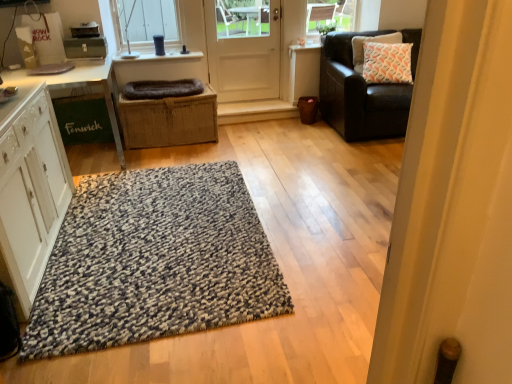
This screenshot has height=384, width=512. Find the location of `white wood cabinet at left`. white wood cabinet at left is located at coordinates (31, 190).

What do you see at coordinates (169, 120) in the screenshot? Image resolution: width=512 pixels, height=384 pixels. I see `braided wicker basket at center` at bounding box center [169, 120].

Where is `white matte door at center`? This screenshot has height=384, width=512. white matte door at center is located at coordinates (243, 48).

Find the location of a particular element. clear glass window at upper center is located at coordinates [147, 21].

Where is `white glossy table at left`? This screenshot has width=512, height=384. white glossy table at left is located at coordinates (83, 90).

Measure the distance between point (152, 223) and camera.

8.92 feet.

Locate an element on the screen. The image size is (512, 384). dark gray plush dog bed at center is located at coordinates (162, 89).

Is dark gray plush dog bed at center next to clear glass window at upper center?

No, dark gray plush dog bed at center is not touching clear glass window at upper center.

From the image's perspective, which one is positioned higher, dark gray plush dog bed at center or clear glass window at upper center?

clear glass window at upper center.

Does dark gray plush dog bed at center have a larger size compared to clear glass window at upper center?

Incorrect, dark gray plush dog bed at center is not larger than clear glass window at upper center.

Which point is more distant from viewer, (125,86) or (144,34)?

The point (144,34) is farther from the camera.

Is white wood cabinet at left in front of or behind clear glass window at upper center in the image?

Clearly, white wood cabinet at left is in front of clear glass window at upper center.

Can clear glass window at upper center be found inside white wood cabinet at left?

That's incorrect, clear glass window at upper center is not inside white wood cabinet at left.

From a real-world perspective, is white wood cabinet at left located higher than clear glass window at upper center?

Actually, white wood cabinet at left is physically below clear glass window at upper center in the real world.

At what (x,y) coordinates should I click in order to perform the action: click on window located on the right of white wood cabinet at left. Please return your answer as a coordinate pair (x, y). The image size is (512, 384). Looking at the image, I should click on (147, 21).

How much distance is there between braided wicker basket at center and dark gray plush dog bed at center?

braided wicker basket at center is 23.50 centimeters from dark gray plush dog bed at center.

Looking at their sizes, would you say braided wicker basket at center is wider or thinner than dark gray plush dog bed at center?

Clearly, braided wicker basket at center has more width compared to dark gray plush dog bed at center.

Would you say dark gray plush dog bed at center is part of braided wicker basket at center's contents?

No, dark gray plush dog bed at center is not a part of braided wicker basket at center.

From the image's perspective, between braided wicker basket at center and dark gray plush dog bed at center, which one is located above?

dark gray plush dog bed at center appears higher in the image.

Is white printed cushion at upper right oriented towards white matte door at center?

No, white printed cushion at upper right does not turn towards white matte door at center.

From the image's perspective, is white printed cushion at upper right below white matte door at center?

Yes, from the image's perspective, white printed cushion at upper right is beneath white matte door at center.

Considering their positions, is white printed cushion at upper right located in front of or behind white matte door at center?

white printed cushion at upper right is in front of white matte door at center.

Between white printed cushion at upper right and white matte door at center, which one appears on the left side from the viewer's perspective?

white matte door at center is more to the left.

Would you say white glossy table at left contains white printed cushion at upper right?

Definitely not — white printed cushion at upper right is not inside white glossy table at left.

From a real-world perspective, who is located higher, white glossy table at left or white printed cushion at upper right?

white printed cushion at upper right is physically above.

Does white glossy table at left have a smaller size compared to white printed cushion at upper right?

Actually, white glossy table at left might be larger than white printed cushion at upper right.

Between white glossy table at left and white printed cushion at upper right, which one has more height?

white glossy table at left.

Can we say dark gray plush dog bed at center lies outside white wood cabinet at left?

Yes, dark gray plush dog bed at center is outside of white wood cabinet at left.

From a real-world perspective, who is located lower, dark gray plush dog bed at center or white wood cabinet at left?

white wood cabinet at left, from a real-world perspective.

Is dark gray plush dog bed at center facing away from white wood cabinet at left?

dark gray plush dog bed at center is not turned away from white wood cabinet at left.

Is dark gray plush dog bed at center next to white wood cabinet at left and touching it?

No, dark gray plush dog bed at center is not in contact with white wood cabinet at left.

Considering the points (137, 217) and (108, 63), which point is in front, point (137, 217) or point (108, 63)?

Positioned in front is point (137, 217).

From a real-world perspective, is speckled wool rug at center located beneath white glossy table at left?

Yes, from a real-world perspective, speckled wool rug at center is under white glossy table at left.

In the scene shown: How much distance is there between speckled wool rug at center and white glossy table at left?

A distance of 4.12 feet exists between speckled wool rug at center and white glossy table at left.

Image resolution: width=512 pixels, height=384 pixels. Identify the location of blanket that is under the clear glass window at upper center (from a real-world perspective). (x=162, y=89).

This screenshot has height=384, width=512. I want to click on window behind the white wood cabinet at left, so click(x=147, y=21).

Looking at the image, which one is located further to braided wicker basket at center, white matte door at center or dark gray plush dog bed at center?

Among the two, white matte door at center is located further to braided wicker basket at center.

Considering their positions, is white printed cushion at upper right positioned closer to clear glass window at upper center than braided wicker basket at center?

The object closer to clear glass window at upper center is braided wicker basket at center.

When comparing their distances from white wood cabinet at left, does speckled wool rug at center or dark gray plush dog bed at center seem further?

dark gray plush dog bed at center is further to white wood cabinet at left.

Which object lies further to the anchor point braided wicker basket at center, white glossy table at left or clear glass window at upper center?

clear glass window at upper center is further to braided wicker basket at center.

Based on their spatial positions, is white matte door at center or clear glass window at upper center closer to braided wicker basket at center?

The object closer to braided wicker basket at center is white matte door at center.

From the image, which object appears to be farther from white wood cabinet at left, braided wicker basket at center or clear glass window at upper center?

clear glass window at upper center lies further to white wood cabinet at left than the other object.

Looking at the image, which one is located further to white matte door at center, braided wicker basket at center or dark gray plush dog bed at center?

Among the two, braided wicker basket at center is located further to white matte door at center.

From the image, which object appears to be farther from braided wicker basket at center, clear glass window at upper center or white wood cabinet at left?

white wood cabinet at left lies further to braided wicker basket at center than the other object.

Find the location of a particular element. crate located between dark gray plush dog bed at center and white printed cushion at upper right in the left-right direction is located at coordinates click(169, 120).

Image resolution: width=512 pixels, height=384 pixels. I want to click on window between white wood cabinet at left and white matte door at center along the z-axis, so click(x=147, y=21).

This screenshot has width=512, height=384. Find the location of `window located between white glossy table at left and white matte door at center in the left-right direction`. window located between white glossy table at left and white matte door at center in the left-right direction is located at coordinates (147, 21).

Find the location of `window located between white wood cabinet at left and white printed cushion at upper right in the left-right direction`. window located between white wood cabinet at left and white printed cushion at upper right in the left-right direction is located at coordinates (147, 21).